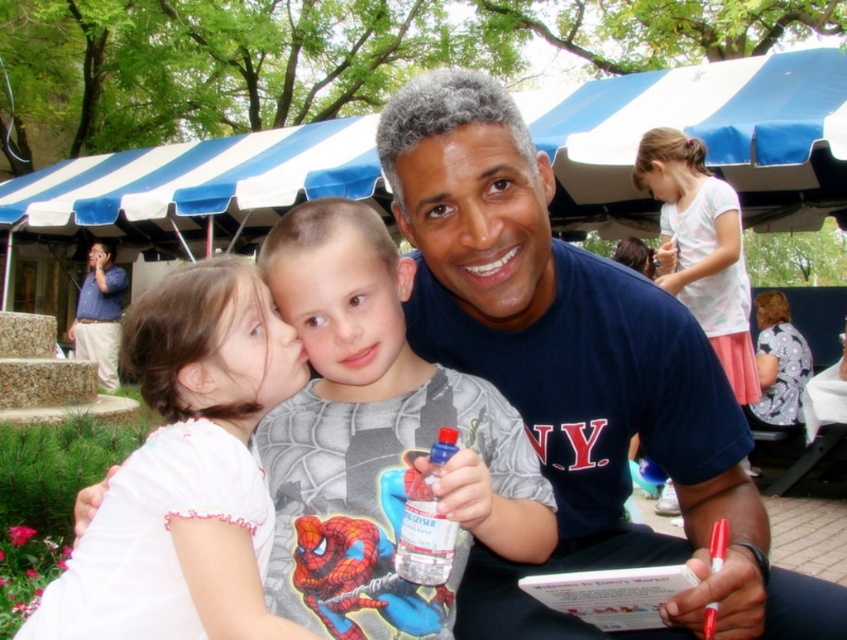
Question: Observing the image, what is the correct spatial positioning of white cotton shirt at upper left in reference to blue shirt at left?

Choices:
 (A) left
 (B) right

Answer: (B)

Question: Among these objects, which one is farthest from the camera?

Choices:
 (A) white cotton shirt at upper left
 (B) blue shirt at left
 (C) spiderman t-shirt at center
 (D) clear plastic bottle at center

Answer: (B)

Question: Observing the image, what is the correct spatial positioning of white cotton shirt at upper left in reference to clear plastic bottle at center?

Choices:
 (A) right
 (B) left

Answer: (B)

Question: Which object is the closest to the spiderman t-shirt at center?

Choices:
 (A) white cotton shirt at upper left
 (B) clear plastic bottle at center

Answer: (B)

Question: Which point appears farthest from the camera in this image?

Choices:
 (A) (97, 337)
 (B) (383, 374)
 (C) (443, 435)
 (D) (222, 513)

Answer: (A)

Question: Does white cotton shirt at upper left have a larger size compared to blue shirt at left?

Choices:
 (A) no
 (B) yes

Answer: (A)